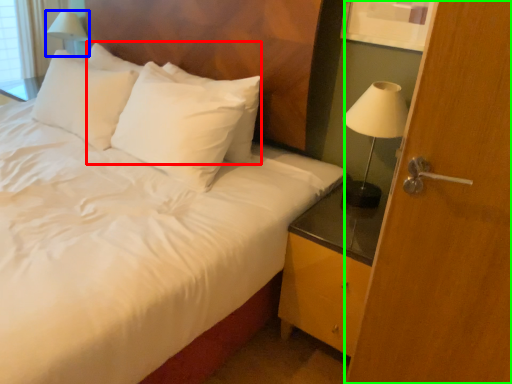
Question: Based on their relative distances, which object is farther from pillow (highlighted by a red box)? Choose from table lamp (highlighted by a blue box) and screen door (highlighted by a green box).

Choices:
 (A) table lamp
 (B) screen door

Answer: (A)